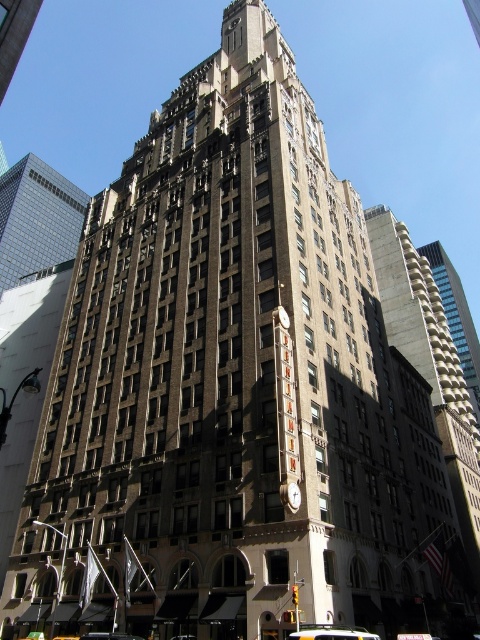
Question: Which of the following is the farthest from the observer?

Choices:
 (A) metallic clock at center
 (B) yellow rubber taxi at center
 (C) brick building at center
 (D) glassy reflective skyscraper at upper left

Answer: (D)

Question: Can you confirm if brick building at center is positioned above yellow rubber taxi at center?

Choices:
 (A) no
 (B) yes

Answer: (B)

Question: Does yellow rubber taxi at center have a greater width compared to metallic clock at center?

Choices:
 (A) no
 (B) yes

Answer: (B)

Question: Does glassy reflective skyscraper at upper left have a larger size compared to yellow rubber taxi at center?

Choices:
 (A) no
 (B) yes

Answer: (B)

Question: Among these points, which one is farthest from the camera?

Choices:
 (A) (301, 637)
 (B) (26, 189)
 (C) (432, 257)
 (D) (288, 486)

Answer: (B)

Question: Which object appears farthest from the camera in this image?

Choices:
 (A) metallic clock at center
 (B) brick building at center
 (C) yellow rubber taxi at center
 (D) glassy reflective skyscraper at upper left

Answer: (D)